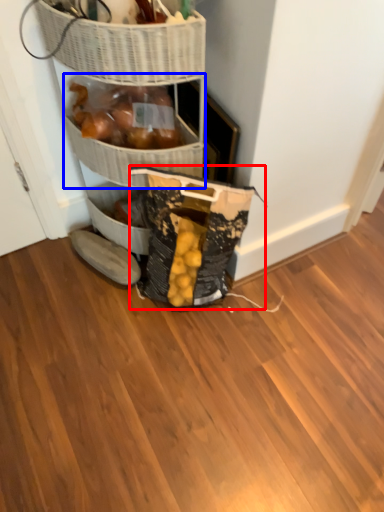
Question: Among these objects, which one is farthest to the camera, material (highlighted by a red box) or basket (highlighted by a blue box)?

Choices:
 (A) material
 (B) basket

Answer: (B)